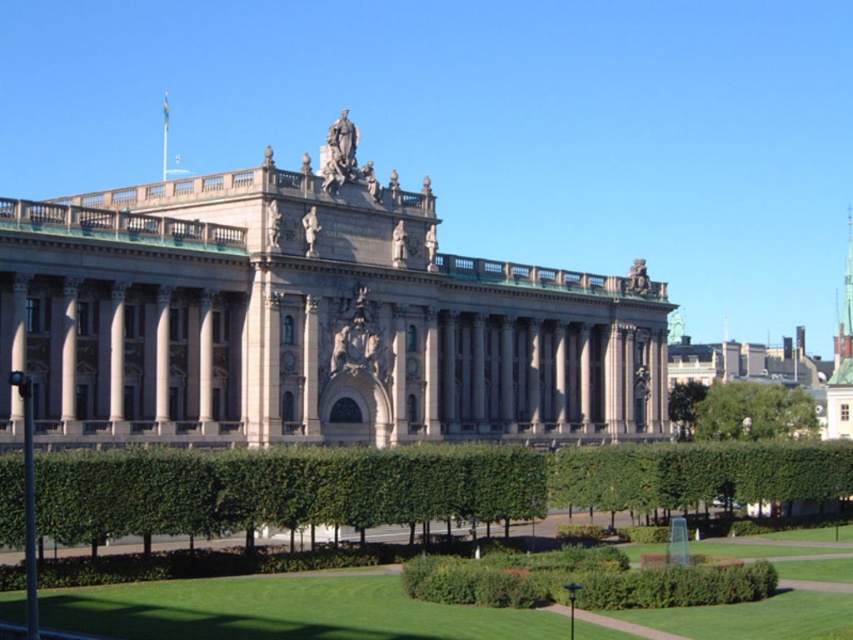
Who is more forward, (300, 211) or (734, 406)?

Point (300, 211)

Is beige stone palace at center positioned behind green leafy tree at lower right?

That is False.

Measure the distance between beige stone palace at center and camera.

beige stone palace at center is 58.63 meters away from camera.

Image resolution: width=853 pixels, height=640 pixels. I want to click on beige stone palace at center, so click(x=308, y=320).